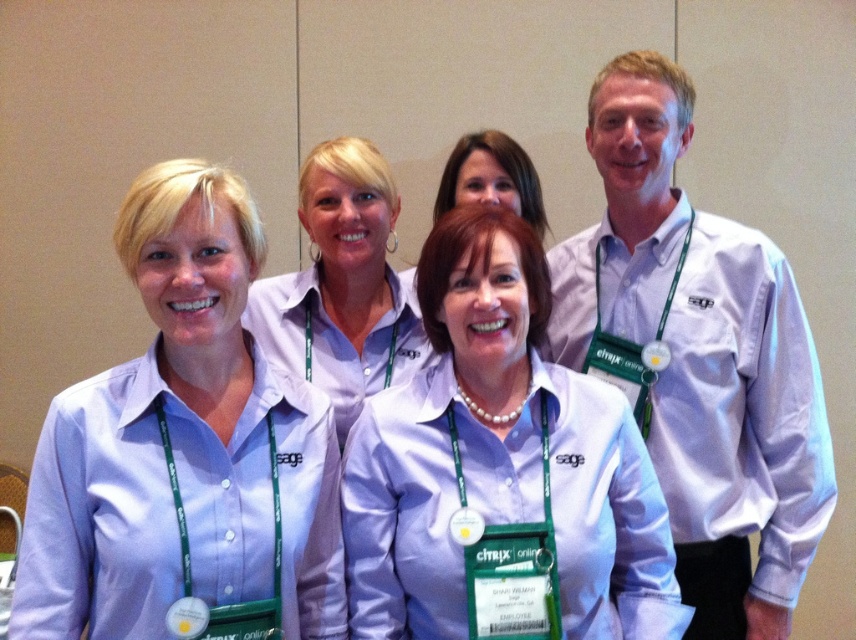
Question: Which point is closer to the camera taking this photo?

Choices:
 (A) (206, 305)
 (B) (391, 342)
 (C) (688, 412)
 (D) (486, 129)

Answer: (A)

Question: Which object is closer to the camera taking this photo?

Choices:
 (A) matte white shirt at center
 (B) pearl necklace at center
 (C) matte purple shirt at center
 (D) matte purple shirt at left

Answer: (D)

Question: Does matte purple shirt at left come behind matte white shirt at center?

Choices:
 (A) no
 (B) yes

Answer: (A)

Question: Does matte purple shirt at center have a smaller size compared to matte white shirt at center?

Choices:
 (A) no
 (B) yes

Answer: (A)

Question: Is the position of matte purple shirt at center more distant than that of pearl necklace at center?

Choices:
 (A) yes
 (B) no

Answer: (B)

Question: Which object is farther from the camera taking this photo?

Choices:
 (A) matte purple shirt at center
 (B) matte white shirt at center
 (C) white shirt at right
 (D) matte purple shirt at left

Answer: (C)